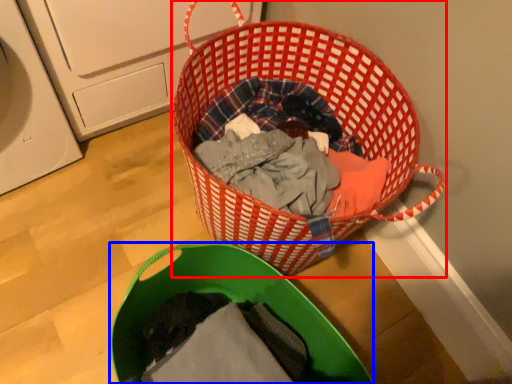
Question: Which object is further to the camera taking this photo, picnic basket (highlighted by a red box) or laundry basket (highlighted by a blue box)?

Choices:
 (A) picnic basket
 (B) laundry basket

Answer: (A)